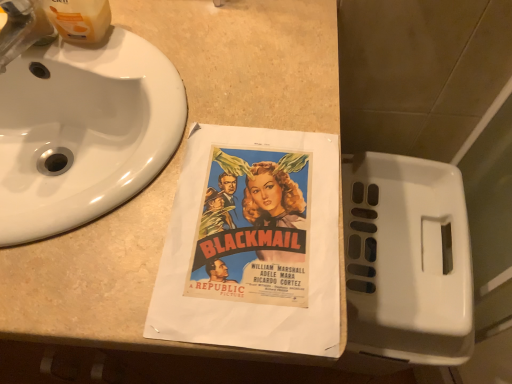
The width and height of the screenshot is (512, 384). What do you see at coordinates (23, 29) in the screenshot?
I see `brushed metal faucet at upper left` at bounding box center [23, 29].

The height and width of the screenshot is (384, 512). I want to click on white glossy sink at upper left, so click(79, 126).

Which of these two, brushed metal faucet at upper left or beige laminate counter at center, is smaller?

With smaller size is brushed metal faucet at upper left.

Which of these two, brushed metal faucet at upper left or beige laminate counter at center, stands shorter?

With less height is brushed metal faucet at upper left.

Which is less distant, (27, 3) or (140, 195)?

Point (27, 3).

Measure the distance from brushed metal faucet at upper left to beige laminate counter at center.

11.70 inches.

Can you confirm if white glossy sink at upper left is shorter than brushed metal faucet at upper left?

In fact, white glossy sink at upper left may be taller than brushed metal faucet at upper left.

Visually, is white glossy sink at upper left positioned to the left or to the right of brushed metal faucet at upper left?

In the image, white glossy sink at upper left appears on the right side of brushed metal faucet at upper left.

Image resolution: width=512 pixels, height=384 pixels. In the image, there is a white glossy sink at upper left. What are the coordinates of `faucet above it (from the image's perspective)` in the screenshot? It's located at (23, 29).

Does point (90, 189) come farther from viewer compared to point (10, 49)?

No, it is in front of (10, 49).

In the scene shown: Which object is positioned more to the right, white glossy sink at upper left or beige laminate counter at center?

white glossy sink at upper left is more to the right.

Between white glossy sink at upper left and beige laminate counter at center, which one has smaller width?

white glossy sink at upper left is thinner.

Can you confirm if white glossy sink at upper left is bigger than beige laminate counter at center?

Incorrect, white glossy sink at upper left is not larger than beige laminate counter at center.

Is white glossy sink at upper left facing towards beige laminate counter at center?

Yes, white glossy sink at upper left is oriented towards beige laminate counter at center.

Considering their positions, is brushed metal faucet at upper left located in front of or behind white glossy sink at upper left?

Visually, brushed metal faucet at upper left is located behind white glossy sink at upper left.

Consider the image. From a real-world perspective, does brushed metal faucet at upper left stand above white glossy sink at upper left?

Yes, from a real-world perspective, brushed metal faucet at upper left is above white glossy sink at upper left.

Does point (5, 28) come behind point (102, 147)?

No.

Does brushed metal faucet at upper left touch white glossy sink at upper left?

No, brushed metal faucet at upper left is not with white glossy sink at upper left.

Does beige laminate counter at center have a larger size compared to white glossy sink at upper left?

Yes, beige laminate counter at center is bigger than white glossy sink at upper left.

From a real-world perspective, who is located higher, beige laminate counter at center or white glossy sink at upper left?

In real-world perspective, white glossy sink at upper left is above.

Would you consider beige laminate counter at center to be distant from white glossy sink at upper left?

beige laminate counter at center is actually quite close to white glossy sink at upper left.

Considering the relative sizes of beige laminate counter at center and brushed metal faucet at upper left in the image provided, is beige laminate counter at center thinner than brushed metal faucet at upper left?

No.

Is beige laminate counter at center positioned with its back to brushed metal faucet at upper left?

No, beige laminate counter at center is not facing away from brushed metal faucet at upper left.

Is brushed metal faucet at upper left located within beige laminate counter at center?

No, brushed metal faucet at upper left is not surrounded by beige laminate counter at center.

This screenshot has height=384, width=512. Identify the location of counter top below the brushed metal faucet at upper left (from the image's perspective). (177, 168).

You are a GUI agent. You are given a task and a screenshot of the screen. Output one action in this format:
    pyautogui.click(x=<x>, y=<y>)
    Task: Click on the faucet above the beige laminate counter at center (from the image's perspective)
    This screenshot has height=384, width=512.
    Given the screenshot: What is the action you would take?
    pyautogui.click(x=23, y=29)

Image resolution: width=512 pixels, height=384 pixels. What are the coordinates of `sink directly beneath the brushed metal faucet at upper left (from a real-world perspective)` in the screenshot? It's located at (79, 126).

Consider the image. When comparing their distances from beige laminate counter at center, does brushed metal faucet at upper left or white glossy sink at upper left seem further?

brushed metal faucet at upper left.

In the scene shown: Looking at the image, which one is located closer to brushed metal faucet at upper left, beige laminate counter at center or white glossy sink at upper left?

white glossy sink at upper left is positioned closer to the anchor brushed metal faucet at upper left.

Which object lies further to the anchor point beige laminate counter at center, white glossy sink at upper left or brushed metal faucet at upper left?

brushed metal faucet at upper left lies further to beige laminate counter at center than the other object.

Based on their spatial positions, is brushed metal faucet at upper left or beige laminate counter at center further from white glossy sink at upper left?

brushed metal faucet at upper left.

When comparing their distances from white glossy sink at upper left, does beige laminate counter at center or brushed metal faucet at upper left seem further?

brushed metal faucet at upper left.

When comparing their distances from brushed metal faucet at upper left, does white glossy sink at upper left or beige laminate counter at center seem further?

The object further to brushed metal faucet at upper left is beige laminate counter at center.

Identify the location of sink between brushed metal faucet at upper left and beige laminate counter at center vertically. (79, 126).